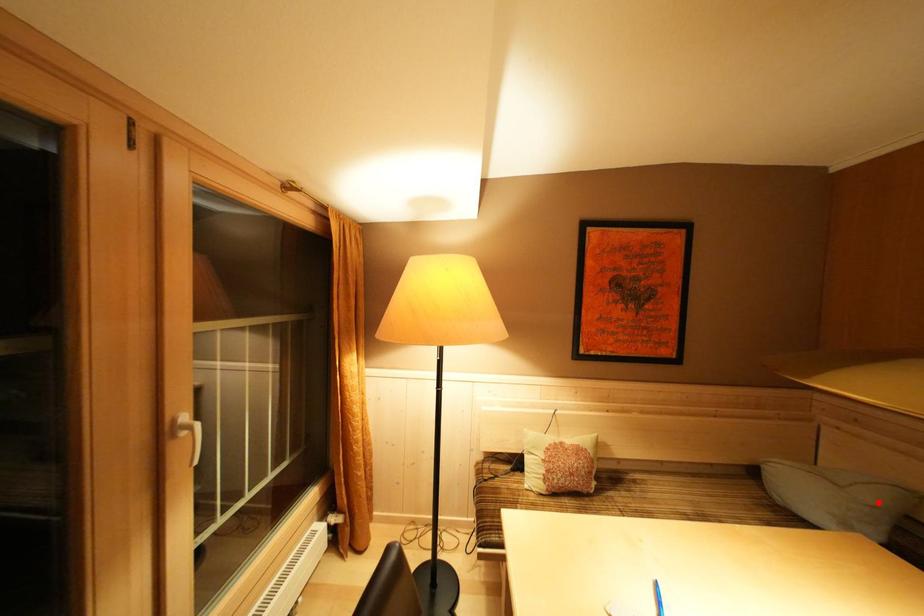
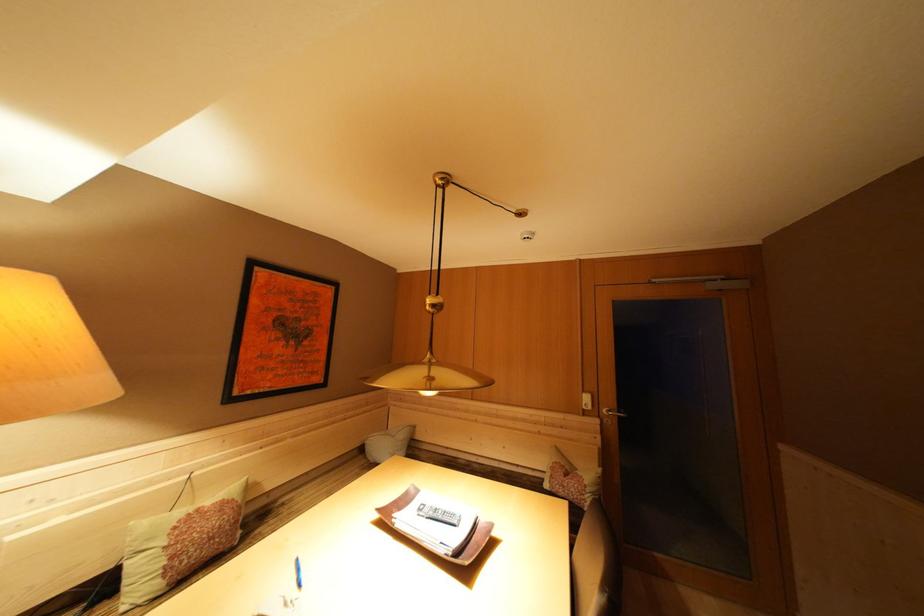
Where in the second image is the point corresponding to the highlighted location from the first image?

(408, 440)